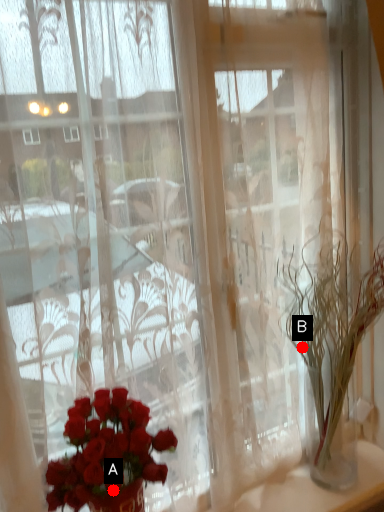
Question: Two points are circled on the image, labeled by A and B beside each circle. Among these points, which one is nearest to the camera?

Choices:
 (A) A is closer
 (B) B is closer

Answer: (A)